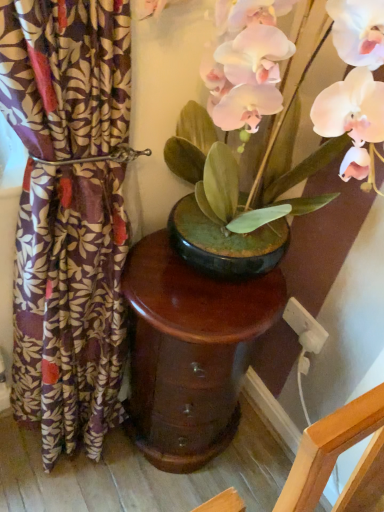
Where is `glossy wood table at center`? glossy wood table at center is located at coordinates (189, 352).

At what (x,y) coordinates should I click in order to perform the action: click on white plastic electric outlet at lower right. Please return your answer as a coordinate pair (x, y). Image resolution: width=384 pixels, height=512 pixels. Looking at the image, I should click on tap(305, 327).

From the image's perspective, which one is positioned higher, matte black pot at center or glossy wood table at center?

matte black pot at center is shown above in the image.

From a real-world perspective, is matte black pot at center over glossy wood table at center?

→ Correct, in the physical world, matte black pot at center is higher than glossy wood table at center.

Where is `electric outlet below the patterned fabric curtain at left (from a real-world perspective)`? electric outlet below the patterned fabric curtain at left (from a real-world perspective) is located at coordinates (305, 327).

From a real-world perspective, between white plastic electric outlet at lower right and patterned fabric curtain at left, who is vertically lower?

white plastic electric outlet at lower right.

Which is more distant, (307, 318) or (49, 300)?

The point (307, 318) is farther from the camera.

Which object is thinner, white plastic electric outlet at lower right or patterned fabric curtain at left?

white plastic electric outlet at lower right is thinner.

Is matte black pot at center surrounded by patterned fabric curtain at left?

No, matte black pot at center is not inside patterned fabric curtain at left.

Which of these two, patterned fabric curtain at left or matte black pot at center, is smaller?

With smaller size is matte black pot at center.

Between patterned fabric curtain at left and matte black pot at center, which one has smaller width?

patterned fabric curtain at left is thinner.

Where is `curtain on the left of the matte black pot at center`? curtain on the left of the matte black pot at center is located at coordinates (69, 305).

Is white plastic electric outlet at lower right at the back of patterned fabric curtain at left?

No, patterned fabric curtain at left's orientation is not away from white plastic electric outlet at lower right.

From a real-world perspective, does patterned fabric curtain at left stand above white plastic electric outlet at lower right?

Yes, from a real-world perspective, patterned fabric curtain at left is over white plastic electric outlet at lower right

Where is `electric outlet below the patterned fabric curtain at left (from the image's perspective)`? The height and width of the screenshot is (512, 384). electric outlet below the patterned fabric curtain at left (from the image's perspective) is located at coordinates (305, 327).

Considering the positions of objects matte black pot at center and patterned fabric curtain at left in the image provided, who is more to the right, matte black pot at center or patterned fabric curtain at left?

matte black pot at center is more to the right.

Can you confirm if matte black pot at center is shorter than patterned fabric curtain at left?

Indeed, matte black pot at center has a lesser height compared to patterned fabric curtain at left.

Considering the relative sizes of matte black pot at center and patterned fabric curtain at left in the image provided, is matte black pot at center bigger than patterned fabric curtain at left?

Actually, matte black pot at center might be smaller than patterned fabric curtain at left.

From a real-world perspective, between matte black pot at center and patterned fabric curtain at left, who is vertically higher?

In real-world perspective, matte black pot at center is above.

Choose the correct answer: Is glossy wood table at center inside matte black pot at center or outside it?

glossy wood table at center cannot be found inside matte black pot at center.

From the image's perspective, which object appears higher, glossy wood table at center or matte black pot at center?

matte black pot at center appears higher in the image.

Considering the relative positions of glossy wood table at center and matte black pot at center in the image provided, is glossy wood table at center to the right of matte black pot at center from the viewer's perspective?

No.

From a real-world perspective, is matte black pot at center below white plastic electric outlet at lower right?

Incorrect, from a real-world perspective, matte black pot at center is higher than white plastic electric outlet at lower right.

Looking at this image, in terms of size, does matte black pot at center appear bigger or smaller than white plastic electric outlet at lower right?

In the image, matte black pot at center appears to be larger than white plastic electric outlet at lower right.

Identify the location of houseplant that is above the white plastic electric outlet at lower right (from the image's perspective). The width and height of the screenshot is (384, 512). (269, 155).

The width and height of the screenshot is (384, 512). I want to click on table located behind the matte black pot at center, so click(x=189, y=352).

Locate an element on the screen. This screenshot has height=512, width=384. curtain that appears on the left of white plastic electric outlet at lower right is located at coordinates (69, 305).

Based on their spatial positions, is patterned fabric curtain at left or glossy wood table at center further from matte black pot at center?

glossy wood table at center lies further to matte black pot at center than the other object.

From the image, which object appears to be nearer to glossy wood table at center, matte black pot at center or white plastic electric outlet at lower right?

Based on the image, matte black pot at center appears to be nearer to glossy wood table at center.

Looking at this image, considering their positions, is patterned fabric curtain at left positioned further to white plastic electric outlet at lower right than glossy wood table at center?

patterned fabric curtain at left lies further to white plastic electric outlet at lower right than the other object.

When comparing their distances from patterned fabric curtain at left, does glossy wood table at center or white plastic electric outlet at lower right seem further?

Among the two, white plastic electric outlet at lower right is located further to patterned fabric curtain at left.

When comparing their distances from patterned fabric curtain at left, does matte black pot at center or white plastic electric outlet at lower right seem closer?

Based on the image, matte black pot at center appears to be nearer to patterned fabric curtain at left.

When comparing their distances from patterned fabric curtain at left, does matte black pot at center or glossy wood table at center seem closer?

glossy wood table at center lies closer to patterned fabric curtain at left than the other object.

Which object lies further to the anchor point white plastic electric outlet at lower right, glossy wood table at center or matte black pot at center?

matte black pot at center.

When comparing their distances from patterned fabric curtain at left, does white plastic electric outlet at lower right or glossy wood table at center seem further?

white plastic electric outlet at lower right is positioned further to the anchor patterned fabric curtain at left.

In order to click on table located between patterned fabric curtain at left and white plastic electric outlet at lower right in the left-right direction in this screenshot , I will do `click(189, 352)`.

At what (x,y) coordinates should I click in order to perform the action: click on curtain positioned between matte black pot at center and white plastic electric outlet at lower right from near to far. Please return your answer as a coordinate pair (x, y). Image resolution: width=384 pixels, height=512 pixels. Looking at the image, I should click on [x=69, y=305].

What are the coordinates of `table situated between patterned fabric curtain at left and matte black pot at center from left to right` in the screenshot? It's located at (189, 352).

The height and width of the screenshot is (512, 384). I want to click on table located between matte black pot at center and white plastic electric outlet at lower right in the depth direction, so click(189, 352).